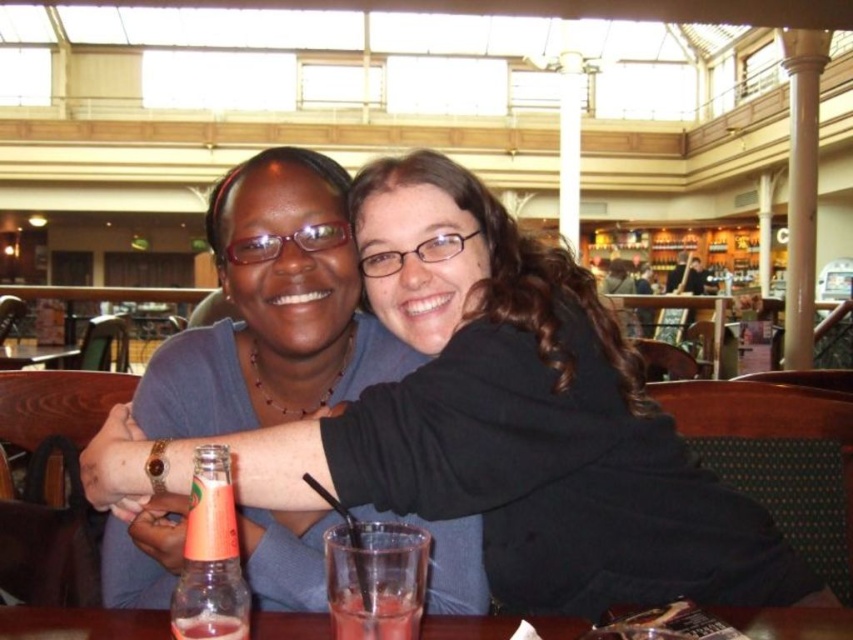
You are a photographer setting up for a portrait. You need to ensure that the matte blue shirt at center and the translucent glass at lower center are both in focus. Which object should you adjust your camera focus on first to ensure both are sharp?

The matte blue shirt at center is wider than the translucent glass at lower center, so you should focus on the wider matte blue shirt at center first to ensure both objects are in focus.

You are a photographer standing at the entrance of the cafe. You need to ensure that the matte blue shirt at center is in the center of your photo. Which direction should you move your camera to adjust the frame?

The matte blue shirt at center is already positioned at the center coordinates of the image, so no adjustment is needed.

You are a photographer standing in front of the scene described. You want to take a closeup shot of the matte blue shirt at center without including any other objects in the frame. Considering your current position, is the distance sufficient to capture the shirt clearly in focus?

The matte blue shirt at center is 30.86 inches from the viewer. Since this distance is within a typical camera lens focusing range, you can capture the matte blue shirt at center clearly in focus without any issues.